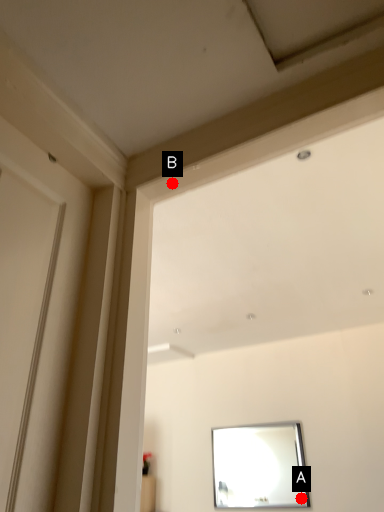
Question: Two points are circled on the image, labeled by A and B beside each circle. Which point appears farthest from the camera in this image?

Choices:
 (A) A is further
 (B) B is further

Answer: (A)